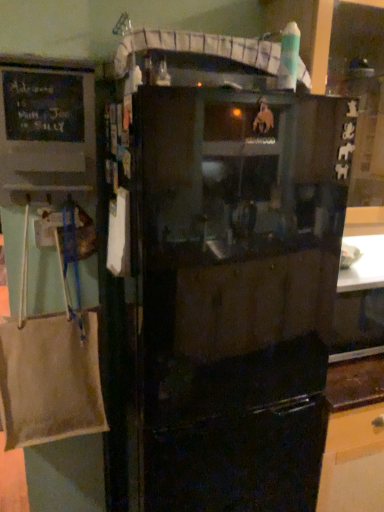
Question: Is chalkboard matte black at left inside or outside of black matte refrigerator at center?

Choices:
 (A) outside
 (B) inside

Answer: (A)

Question: Looking at their shapes, would you say chalkboard matte black at left is wider or thinner than black matte refrigerator at center?

Choices:
 (A) wide
 (B) thin

Answer: (B)

Question: Visually, is chalkboard matte black at left positioned to the left or to the right of black matte refrigerator at center?

Choices:
 (A) right
 (B) left

Answer: (B)

Question: From the image's perspective, is black matte refrigerator at center positioned above or below chalkboard matte black at left?

Choices:
 (A) above
 (B) below

Answer: (B)

Question: Looking at their shapes, would you say black matte refrigerator at center is wider or thinner than chalkboard matte black at left?

Choices:
 (A) wide
 (B) thin

Answer: (A)

Question: Is black matte refrigerator at center bigger or smaller than chalkboard matte black at left?

Choices:
 (A) big
 (B) small

Answer: (A)

Question: From a real-world perspective, relative to chalkboard matte black at left, is black matte refrigerator at center vertically above or below?

Choices:
 (A) below
 (B) above

Answer: (A)